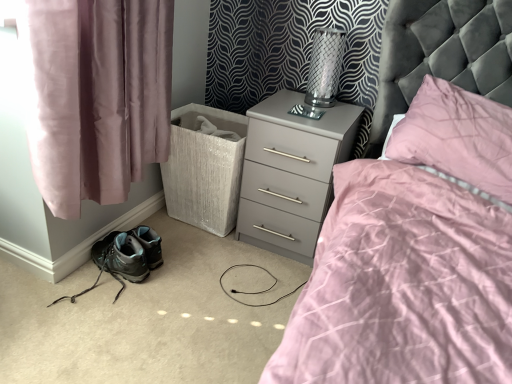
You are a GUI agent. You are given a task and a screenshot of the screen. Output one action in this format:
    pyautogui.click(x=<x>, y=<y>)
    Task: Click on the vacant space underneath matte gray hiking boots at lower left (from a real-world perspective)
    
    Given the screenshot: What is the action you would take?
    pyautogui.click(x=92, y=291)